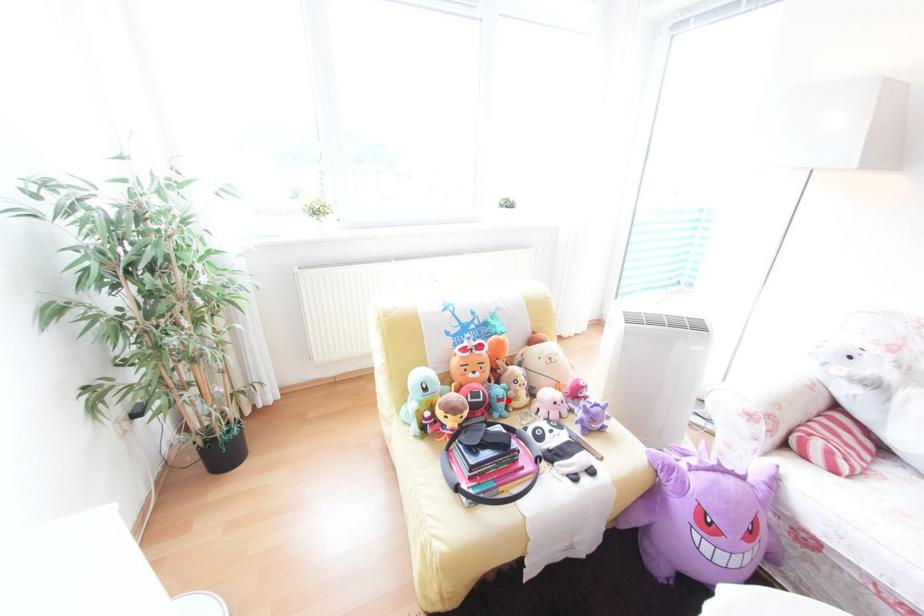
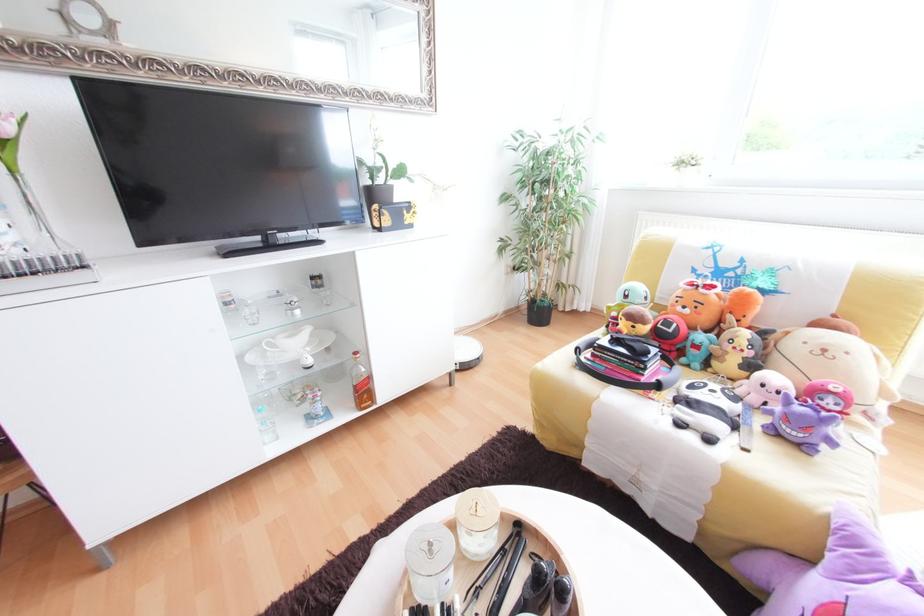
Locate, in the second image, the point that corresponds to the highlighted location in the first image.

(704, 347)